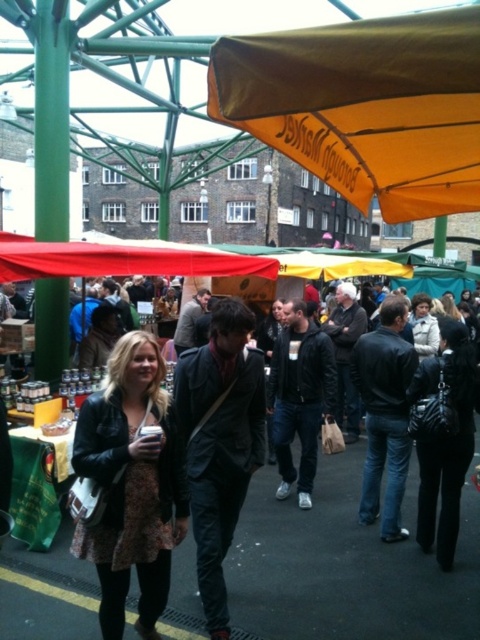
You are standing at the market and want to take a photo of the orange fabric canopy at upper center without the leather jacket at center blocking the view. Is this possible?

The orange fabric canopy at upper center is closer to the viewer than the leather jacket at center, so you can take a photo of the orange fabric canopy at upper center without the leather jacket at center blocking the view because the canopy is in front of the jacket.

What are the coordinates of the orange fabric canopy at upper center in the image?

The orange fabric canopy at upper center is located at coordinates 0.167 on the x axis and 0.760 on the y axis.